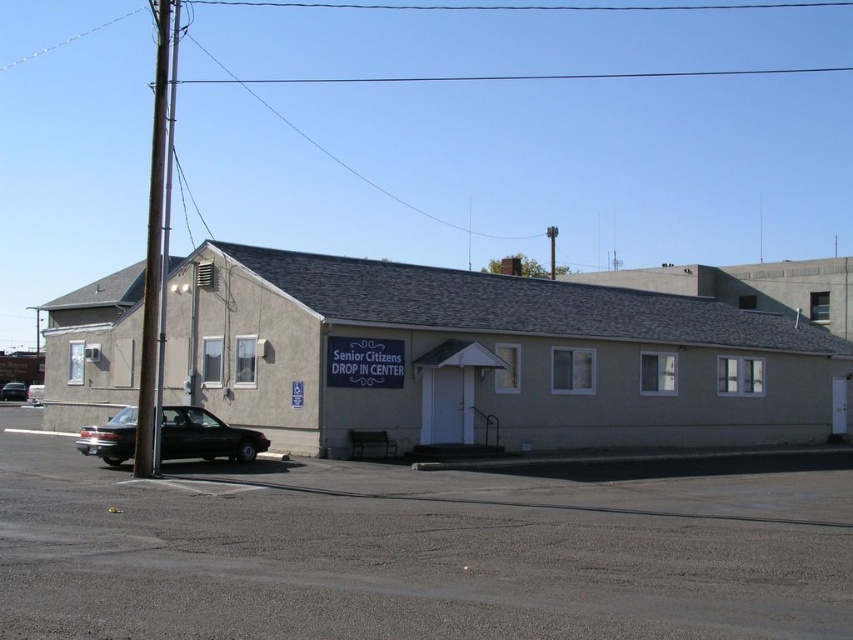
You are a visitor arriving at the Senior Citizens DROP IN CENTER. You need to park your car on the gray asphalt parking lot at lower left. However, there is a shiny black sedan at center in the way. Can you drive directly to the parking lot without moving the sedan?

The gray asphalt parking lot at lower left is above the shiny black sedan at center, so you can drive directly to the gray asphalt parking lot at lower left without needing to move the sedan since it is positioned below.

You need to park your car which is 4 meters long in the parking lot. The shiny black sedan at lower left is already parked there. Can you park your car in the gray asphalt parking lot at lower left without overlapping the sedan?

The gray asphalt parking lot at lower left has a width larger than the shiny black sedan at lower left, so yes, you can park your car there without overlapping the sedan.